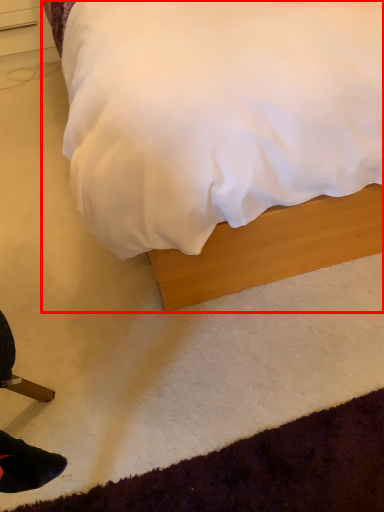
Question: From the image's perspective, what is the correct spatial positioning of bed (annotated by the red box) in reference to drawer?

Choices:
 (A) above
 (B) below

Answer: (B)